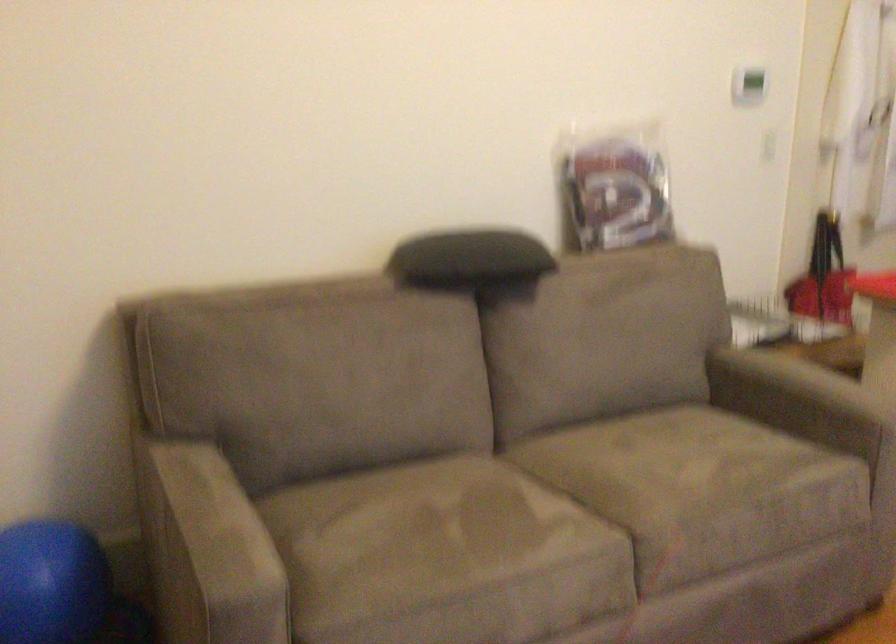
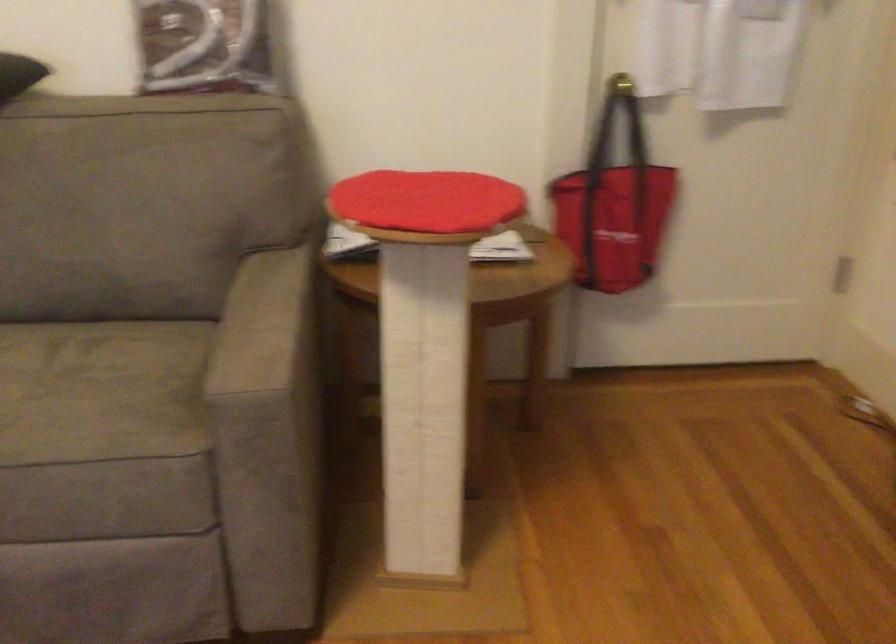
Which direction would the cameraman need to move to produce the second image?

The movement direction of the cameraman is right, forward.